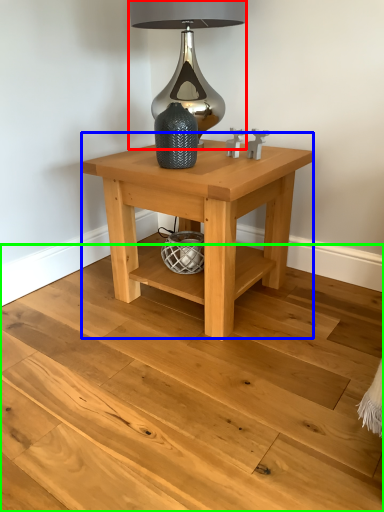
Question: Which object is the farthest from table lamp (highlighted by a red box)? Choose among these: table (highlighted by a blue box) or stair (highlighted by a green box).

Choices:
 (A) table
 (B) stair

Answer: (B)